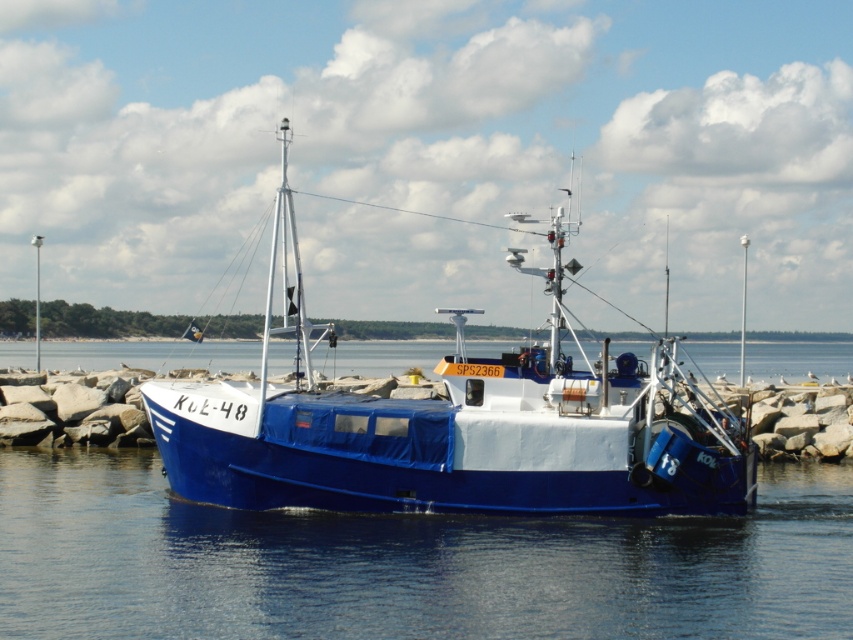
You are standing on the rocky jetty and want to take a photo of the blue smooth water at center. Where should you aim your camera to capture it?

You should aim your camera at point [407,563] to capture the blue smooth water at center.

You are standing on the rocky jetty observing the blue smooth water at center and the blue matte boat at center. Which object is closer to you from your vantage point on the jetty?

The blue smooth water at center is closer to you because it is in front of the blue matte boat at center.